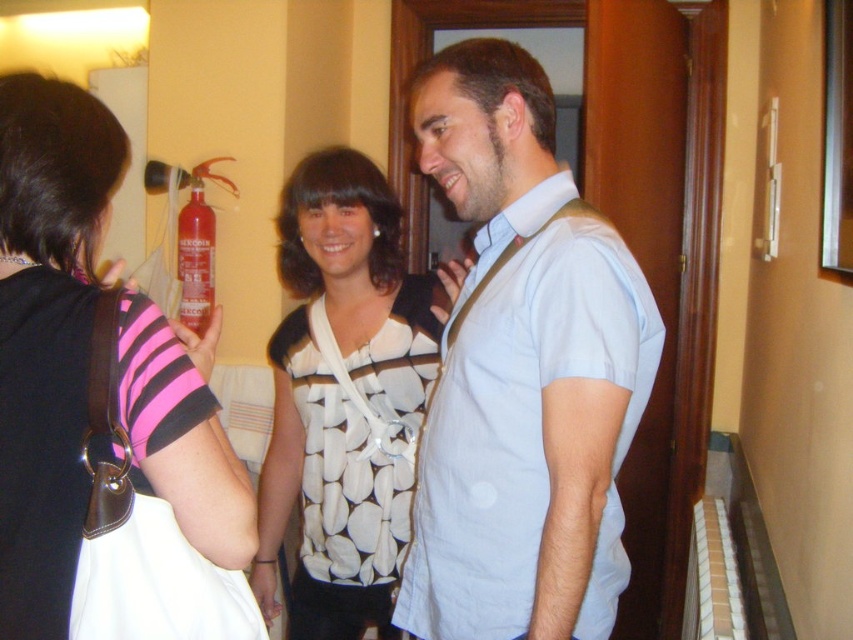
Based on the photo, who is shorter, light blue shirt at center or white dotted fabric at center?

With less height is light blue shirt at center.

Does light blue shirt at center have a greater width compared to white dotted fabric at center?

Incorrect, light blue shirt at center's width does not surpass white dotted fabric at center's.

Which is behind, point (582, 506) or point (393, 202)?

The point (393, 202) is more distant.

Locate an element on the screen. light blue shirt at center is located at coordinates (521, 372).

Is light blue shirt at center bigger than pink striped shirt at upper left?

Yes.

Where is `light blue shirt at center`? This screenshot has height=640, width=853. light blue shirt at center is located at coordinates (521, 372).

Looking at this image, which is above, pink striped shirt at upper left or white dotted fabric at center?

pink striped shirt at upper left is above.

Does pink striped shirt at upper left appear on the left side of white dotted fabric at center?

Yes, pink striped shirt at upper left is to the left of white dotted fabric at center.

In order to click on pink striped shirt at upper left in this screenshot , I will do tap(102, 410).